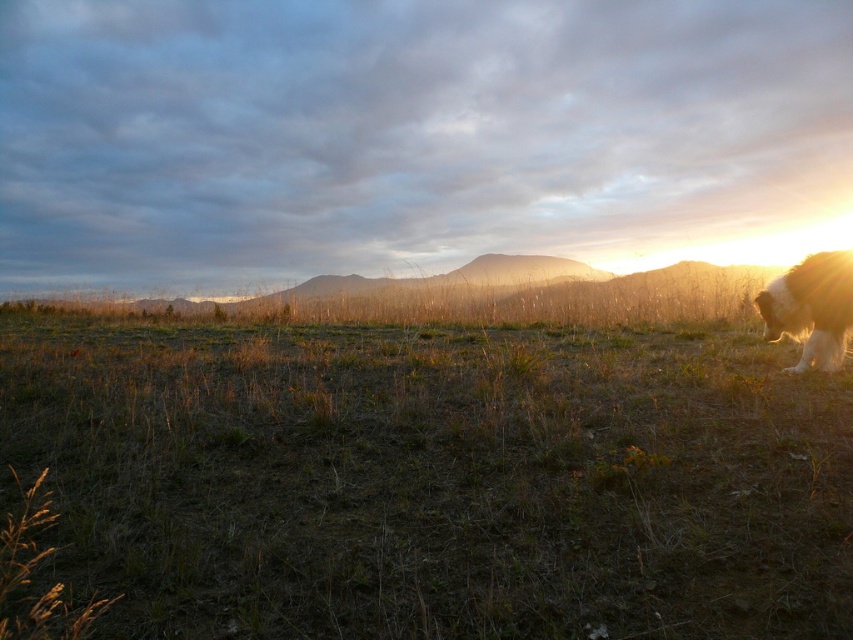
Question: Among these objects, which one is farthest from the camera?

Choices:
 (A) brown dry grass at center
 (B) fuzzy white dog at right

Answer: (B)

Question: Does brown dry grass at center have a greater width compared to fuzzy white dog at right?

Choices:
 (A) no
 (B) yes

Answer: (B)

Question: Does brown dry grass at center appear on the right side of fuzzy white dog at right?

Choices:
 (A) no
 (B) yes

Answer: (A)

Question: Which of the following is the closest to the observer?

Choices:
 (A) brown dry grass at center
 (B) fuzzy white dog at right

Answer: (A)

Question: Does brown dry grass at center come in front of fuzzy white dog at right?

Choices:
 (A) yes
 (B) no

Answer: (A)

Question: Among these objects, which one is nearest to the camera?

Choices:
 (A) brown dry grass at center
 (B) fuzzy white dog at right

Answer: (A)